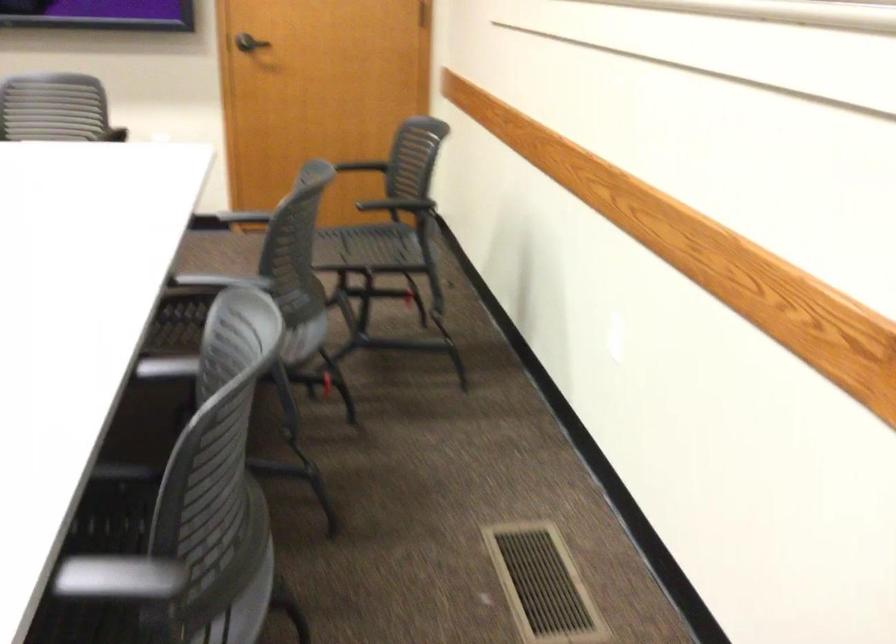
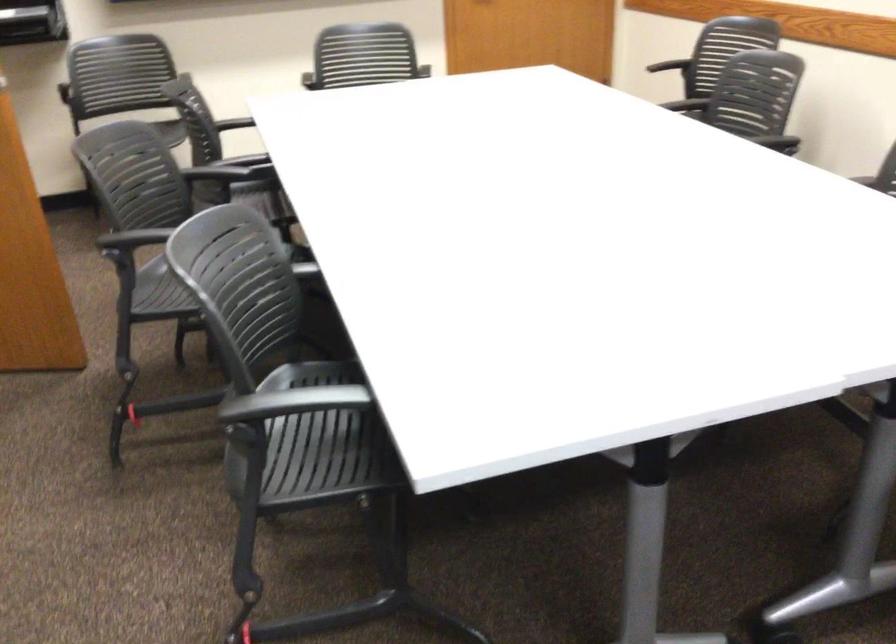
In the scene shown: Which direction would the cameraman need to move to produce the second image?

The movement direction of the cameraman is left, backward.